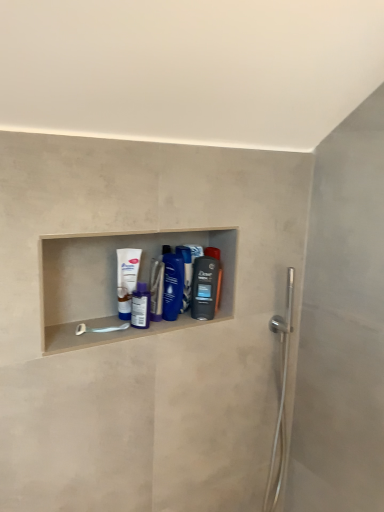
What do you see at coordinates (140, 306) in the screenshot? I see `purple glossy mouthwash at center, which is the fourth mouthwash from right to left` at bounding box center [140, 306].

What is the approximate width of blue glossy shampoo bottle at center?

It is 7.35 centimeters.

At what (x,y) coordinates should I click in order to perform the action: click on blue glossy shampoo bottle at center. Please return your answer as a coordinate pair (x, y). The height and width of the screenshot is (512, 384). Looking at the image, I should click on (186, 275).

How much space does translucent plastic mouthwash at center, which ranks as the fifth mouthwash in left-to-right order, occupy vertically?

translucent plastic mouthwash at center, which ranks as the fifth mouthwash in left-to-right order, is 8.03 inches in height.

Where is `blue glossy bottle at center, positioned as the 3th mouthwash in right-to-left order`? blue glossy bottle at center, positioned as the 3th mouthwash in right-to-left order is located at coordinates (156, 289).

Where is `purple glossy mouthwash at center, which is the fourth mouthwash from right to left`? purple glossy mouthwash at center, which is the fourth mouthwash from right to left is located at coordinates (140, 306).

From the picture: From the image's perspective, between white plastic towel bar at lower left and purple glossy mouthwash at center, marked as the 2th mouthwash in a left-to-right arrangement, which one is located above?

purple glossy mouthwash at center, marked as the 2th mouthwash in a left-to-right arrangement, appears higher in the image.

How different are the orientations of white plastic towel bar at lower left and purple glossy mouthwash at center, marked as the 2th mouthwash in a left-to-right arrangement, in degrees?

They differ by 2.88 degrees in their facing directions.

Consider the image. In the image, is white plastic towel bar at lower left on the left side or the right side of purple glossy mouthwash at center, marked as the 2th mouthwash in a left-to-right arrangement?

Clearly, white plastic towel bar at lower left is on the left of purple glossy mouthwash at center, marked as the 2th mouthwash in a left-to-right arrangement, in the image.

Does white plastic towel bar at lower left have a greater width compared to purple glossy mouthwash at center, marked as the 2th mouthwash in a left-to-right arrangement?

Yes, white plastic towel bar at lower left is wider than purple glossy mouthwash at center, marked as the 2th mouthwash in a left-to-right arrangement.

Based on the photo, does blue glossy shampoo bottle at center appear on the right side of blue glossy bottle at center, placed as the fourth mouthwash when sorted from left to right?

Yes.

Would you say blue glossy shampoo bottle at center is a long distance from blue glossy bottle at center, placed as the fourth mouthwash when sorted from left to right?

That's not correct — blue glossy shampoo bottle at center is a little close to blue glossy bottle at center, placed as the fourth mouthwash when sorted from left to right.

From the image's perspective, is blue glossy shampoo bottle at center on top of blue glossy bottle at center, placed as the fourth mouthwash when sorted from left to right?

Yes, from the image's perspective, blue glossy shampoo bottle at center is on top of blue glossy bottle at center, placed as the fourth mouthwash when sorted from left to right.

This screenshot has height=512, width=384. What are the coordinates of `toiletry above the blue glossy bottle at center, acting as the second mouthwash starting from the right (from the image's perspective)` in the screenshot? It's located at (186, 275).

Can white glossy tube at center, the first mouthwash in the left-to-right sequence, be found inside blue glossy bottle at center, acting as the second mouthwash starting from the right?

No, white glossy tube at center, the first mouthwash in the left-to-right sequence, is not inside blue glossy bottle at center, acting as the second mouthwash starting from the right.

Is blue glossy bottle at center, placed as the fourth mouthwash when sorted from left to right, placed right next to white glossy tube at center, acting as the fifth mouthwash starting from the right?

No, blue glossy bottle at center, placed as the fourth mouthwash when sorted from left to right, is not with white glossy tube at center, acting as the fifth mouthwash starting from the right.

From the image's perspective, which object appears higher, blue glossy bottle at center, acting as the second mouthwash starting from the right, or white glossy tube at center, acting as the fifth mouthwash starting from the right?

white glossy tube at center, acting as the fifth mouthwash starting from the right, from the image's perspective.

Where is `the 3rd mouthwash to the left of the blue glossy bottle at center, placed as the fourth mouthwash when sorted from left to right, counting from the anchor's position`? The width and height of the screenshot is (384, 512). the 3rd mouthwash to the left of the blue glossy bottle at center, placed as the fourth mouthwash when sorted from left to right, counting from the anchor's position is located at coordinates (126, 279).

Who is more distant, purple glossy mouthwash at center, which is the fourth mouthwash from right to left, or blue glossy bottle at center, acting as the second mouthwash starting from the right?

Positioned behind is blue glossy bottle at center, acting as the second mouthwash starting from the right.

Is blue glossy bottle at center, acting as the second mouthwash starting from the right, inside purple glossy mouthwash at center, which is the fourth mouthwash from right to left?

No, blue glossy bottle at center, acting as the second mouthwash starting from the right, is not surrounded by purple glossy mouthwash at center, which is the fourth mouthwash from right to left.

Where is `the 2nd mouthwash behind the purple glossy mouthwash at center, which is the fourth mouthwash from right to left, starting your count from the anchor`? the 2nd mouthwash behind the purple glossy mouthwash at center, which is the fourth mouthwash from right to left, starting your count from the anchor is located at coordinates (172, 284).

Could you tell me if purple glossy mouthwash at center, marked as the 2th mouthwash in a left-to-right arrangement, is turned towards blue glossy bottle at center, acting as the second mouthwash starting from the right?

No, purple glossy mouthwash at center, marked as the 2th mouthwash in a left-to-right arrangement, does not turn towards blue glossy bottle at center, acting as the second mouthwash starting from the right.

In order to click on the 1st mouthwash to the right of the purple glossy mouthwash at center, which is the fourth mouthwash from right to left, starting your count from the anchor in this screenshot , I will do `click(156, 289)`.

Is blue glossy bottle at center, marked as the third mouthwash in a left-to-right arrangement, directly adjacent to purple glossy mouthwash at center, marked as the 2th mouthwash in a left-to-right arrangement?

Yes, blue glossy bottle at center, marked as the third mouthwash in a left-to-right arrangement, is next to purple glossy mouthwash at center, marked as the 2th mouthwash in a left-to-right arrangement.

Is blue glossy bottle at center, marked as the third mouthwash in a left-to-right arrangement, inside or outside of purple glossy mouthwash at center, which is the fourth mouthwash from right to left?

blue glossy bottle at center, marked as the third mouthwash in a left-to-right arrangement, is located beyond the bounds of purple glossy mouthwash at center, which is the fourth mouthwash from right to left.

Is blue glossy bottle at center, marked as the third mouthwash in a left-to-right arrangement, in front of or behind purple glossy mouthwash at center, marked as the 2th mouthwash in a left-to-right arrangement, in the image?

Clearly, blue glossy bottle at center, marked as the third mouthwash in a left-to-right arrangement, is behind purple glossy mouthwash at center, marked as the 2th mouthwash in a left-to-right arrangement.

Would you say white glossy tube at center, acting as the fifth mouthwash starting from the right, is inside or outside purple glossy mouthwash at center, which is the fourth mouthwash from right to left?

white glossy tube at center, acting as the fifth mouthwash starting from the right, is not enclosed by purple glossy mouthwash at center, which is the fourth mouthwash from right to left.

Which is closer, [122,316] or [139,305]?

Clearly, point [122,316] is closer to the camera than point [139,305].

Is white glossy tube at center, the first mouthwash in the left-to-right sequence, aimed at purple glossy mouthwash at center, marked as the 2th mouthwash in a left-to-right arrangement?

Yes, white glossy tube at center, the first mouthwash in the left-to-right sequence, is turned towards purple glossy mouthwash at center, marked as the 2th mouthwash in a left-to-right arrangement.

From a real-world perspective, which object rests below the other?

purple glossy mouthwash at center, marked as the 2th mouthwash in a left-to-right arrangement, from a real-world perspective.

Based on the photo, considering the positions of objects blue glossy bottle at center, acting as the second mouthwash starting from the right, and white plastic towel bar at lower left in the image provided, who is in front, blue glossy bottle at center, acting as the second mouthwash starting from the right, or white plastic towel bar at lower left?

white plastic towel bar at lower left is in front.

Image resolution: width=384 pixels, height=512 pixels. In order to click on towel bar on the left of blue glossy bottle at center, acting as the second mouthwash starting from the right in this screenshot , I will do `click(100, 329)`.

Does blue glossy bottle at center, placed as the fourth mouthwash when sorted from left to right, have a larger size compared to white plastic towel bar at lower left?

Correct, blue glossy bottle at center, placed as the fourth mouthwash when sorted from left to right, is larger in size than white plastic towel bar at lower left.

In order to click on mouthwash that is the 1st one when counting backward from the white plastic towel bar at lower left in this screenshot , I will do `click(140, 306)`.

Find the location of a particular element. Image resolution: width=384 pixels, height=512 pixels. mouthwash that is the 1st object to the left of the blue glossy shampoo bottle at center, starting at the anchor is located at coordinates (172, 284).

When comparing their distances from translucent plastic mouthwash at center, which ranks as the fifth mouthwash in left-to-right order, does white glossy tube at center, the first mouthwash in the left-to-right sequence, or blue glossy bottle at center, marked as the third mouthwash in a left-to-right arrangement, seem further?

Among the two, white glossy tube at center, the first mouthwash in the left-to-right sequence, is located further to translucent plastic mouthwash at center, which ranks as the fifth mouthwash in left-to-right order.

In the scene shown: Considering their positions, is white plastic towel bar at lower left positioned further to blue glossy shampoo bottle at center than translucent plastic mouthwash at center, which ranks as the fifth mouthwash in left-to-right order?

Based on the image, white plastic towel bar at lower left appears to be further to blue glossy shampoo bottle at center.

Which object lies nearer to the anchor point white glossy tube at center, acting as the fifth mouthwash starting from the right, blue glossy bottle at center, marked as the third mouthwash in a left-to-right arrangement, or white plastic towel bar at lower left?

Among the two, blue glossy bottle at center, marked as the third mouthwash in a left-to-right arrangement, is located nearer to white glossy tube at center, acting as the fifth mouthwash starting from the right.

Which object lies nearer to the anchor point blue glossy bottle at center, marked as the third mouthwash in a left-to-right arrangement, blue glossy shampoo bottle at center or blue glossy bottle at center, placed as the fourth mouthwash when sorted from left to right?

Based on the image, blue glossy bottle at center, placed as the fourth mouthwash when sorted from left to right, appears to be nearer to blue glossy bottle at center, marked as the third mouthwash in a left-to-right arrangement.

Based on their spatial positions, is purple glossy mouthwash at center, marked as the 2th mouthwash in a left-to-right arrangement, or blue glossy bottle at center, marked as the third mouthwash in a left-to-right arrangement, further from white plastic towel bar at lower left?

Among the two, blue glossy bottle at center, marked as the third mouthwash in a left-to-right arrangement, is located further to white plastic towel bar at lower left.

Considering their positions, is blue glossy bottle at center, marked as the third mouthwash in a left-to-right arrangement, positioned closer to blue glossy shampoo bottle at center than white glossy tube at center, acting as the fifth mouthwash starting from the right?

blue glossy bottle at center, marked as the third mouthwash in a left-to-right arrangement, lies closer to blue glossy shampoo bottle at center than the other object.

Considering their positions, is white glossy tube at center, the first mouthwash in the left-to-right sequence, positioned further to purple glossy mouthwash at center, which is the fourth mouthwash from right to left, than blue glossy bottle at center, acting as the second mouthwash starting from the right?

Among the two, blue glossy bottle at center, acting as the second mouthwash starting from the right, is located further to purple glossy mouthwash at center, which is the fourth mouthwash from right to left.

Considering their positions, is blue glossy shampoo bottle at center positioned closer to white plastic towel bar at lower left than translucent plastic mouthwash at center, the 1th mouthwash viewed from the right?

blue glossy shampoo bottle at center lies closer to white plastic towel bar at lower left than the other object.

You are a GUI agent. You are given a task and a screenshot of the screen. Output one action in this format:
    pyautogui.click(x=<x>, y=<y>)
    Task: Click on the mouthwash between white glossy tube at center, acting as the fifth mouthwash starting from the right, and blue glossy bottle at center, positioned as the 3th mouthwash in right-to-left order, from left to right
    This screenshot has height=512, width=384.
    Given the screenshot: What is the action you would take?
    pyautogui.click(x=140, y=306)

Where is `toiletry situated between blue glossy bottle at center, positioned as the 3th mouthwash in right-to-left order, and translucent plastic mouthwash at center, which ranks as the fifth mouthwash in left-to-right order, from left to right`? toiletry situated between blue glossy bottle at center, positioned as the 3th mouthwash in right-to-left order, and translucent plastic mouthwash at center, which ranks as the fifth mouthwash in left-to-right order, from left to right is located at coordinates (186, 275).

This screenshot has width=384, height=512. Identify the location of toiletry between white glossy tube at center, acting as the fifth mouthwash starting from the right, and translucent plastic mouthwash at center, the 1th mouthwash viewed from the right, from left to right. (186, 275).

You are a GUI agent. You are given a task and a screenshot of the screen. Output one action in this format:
    pyautogui.click(x=<x>, y=<y>)
    Task: Click on the mouthwash between purple glossy mouthwash at center, which is the fourth mouthwash from right to left, and blue glossy bottle at center, placed as the fourth mouthwash when sorted from left to right, from left to right
    Image resolution: width=384 pixels, height=512 pixels.
    Given the screenshot: What is the action you would take?
    pyautogui.click(x=156, y=289)